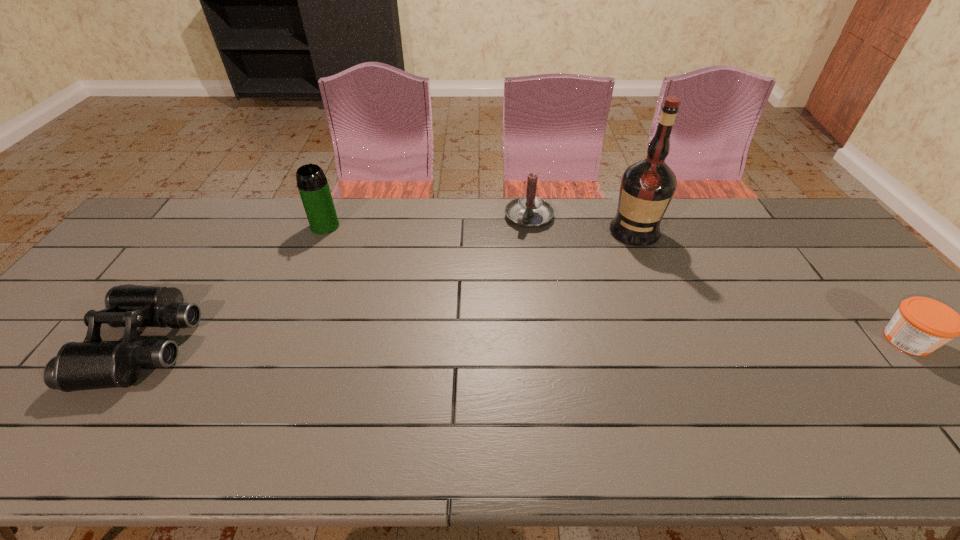
At what (x,y) coordinates should I click in order to perform the action: click on blank area at the right edge. Please return your answer as a coordinate pair (x, y). Looking at the image, I should click on (832, 265).

The width and height of the screenshot is (960, 540). In the image, there is a desktop. Find the location of `vacant space at the far right corner`. vacant space at the far right corner is located at coordinates (770, 221).

This screenshot has width=960, height=540. In order to click on free space between the shortest object and the leftmost object in this screenshot , I will do `click(526, 342)`.

Where is `free spot between the leftmost object and the candle`? The height and width of the screenshot is (540, 960). free spot between the leftmost object and the candle is located at coordinates (337, 281).

Find the location of `free space that is in between the rightmost object and the thermos bottle`. free space that is in between the rightmost object and the thermos bottle is located at coordinates (616, 283).

This screenshot has width=960, height=540. Find the location of `vacant area between the leftmost object and the second object from right to left`. vacant area between the leftmost object and the second object from right to left is located at coordinates (389, 288).

Where is `vacant region between the fourth object from right to left and the leftmost object`? This screenshot has height=540, width=960. vacant region between the fourth object from right to left and the leftmost object is located at coordinates (234, 285).

Where is `unoccupied position between the leftmost object and the candle`? This screenshot has width=960, height=540. unoccupied position between the leftmost object and the candle is located at coordinates (337, 281).

Locate an element on the screen. free space that is in between the third tallest object and the leftmost object is located at coordinates (337, 281).

The width and height of the screenshot is (960, 540). Find the location of `free space that is in between the jam and the leftmost object`. free space that is in between the jam and the leftmost object is located at coordinates (526, 342).